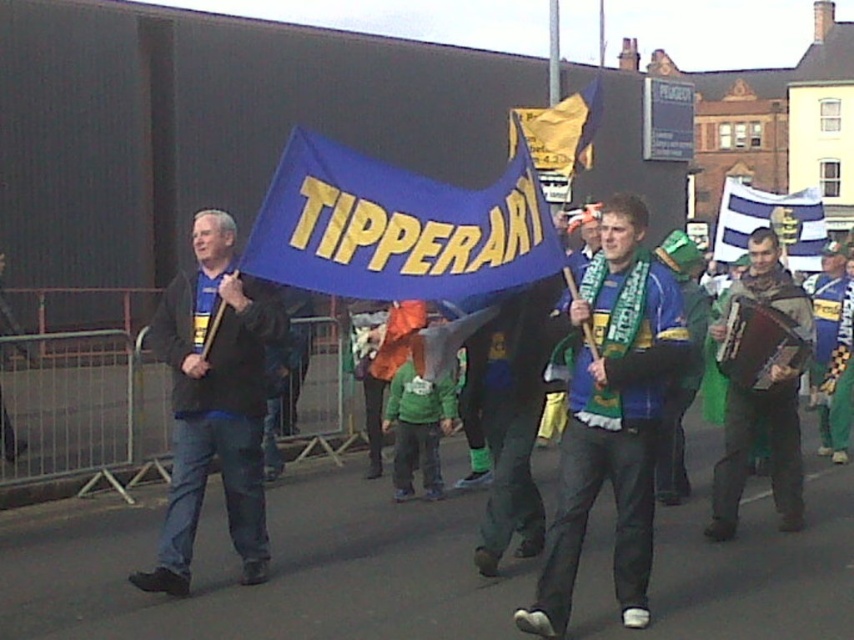
What do you see at coordinates (612, 417) in the screenshot? The width and height of the screenshot is (854, 640). I see `blue woolen scarf at center` at bounding box center [612, 417].

Does blue woolen scarf at center come behind blue striped flag at center?

That is False.

Measure the distance between blue woolen scarf at center and camera.

blue woolen scarf at center is 5.13 meters from camera.

Identify the location of blue woolen scarf at center. The width and height of the screenshot is (854, 640). (612, 417).

Can you confirm if dark blue jeans at left is positioned to the right of yellow paper flag at upper center?

Incorrect, dark blue jeans at left is not on the right side of yellow paper flag at upper center.

Between point (186, 292) and point (525, 113), which one is positioned in front?

Point (186, 292)

What do you see at coordinates (214, 401) in the screenshot? This screenshot has height=640, width=854. I see `dark blue jeans at left` at bounding box center [214, 401].

The image size is (854, 640). Find the location of `dark blue jeans at left`. dark blue jeans at left is located at coordinates (214, 401).

Between green knitted scarf at center and brown leather accordion at right, which one appears on the right side from the viewer's perspective?

brown leather accordion at right

Which is in front, point (483, 330) or point (787, 385)?

Point (483, 330) is in front.

In order to click on green knitted scarf at center in this screenshot , I will do `click(510, 417)`.